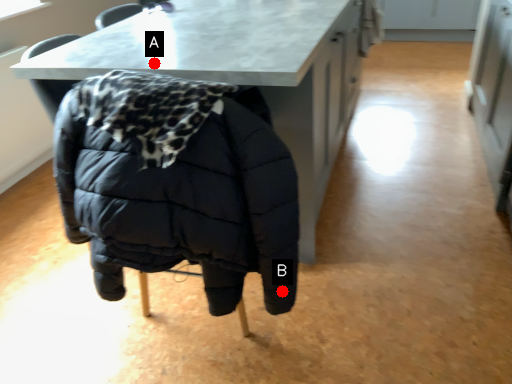
Question: Two points are circled on the image, labeled by A and B beside each circle. Which point appears closest to the camera in this image?

Choices:
 (A) A is closer
 (B) B is closer

Answer: (B)